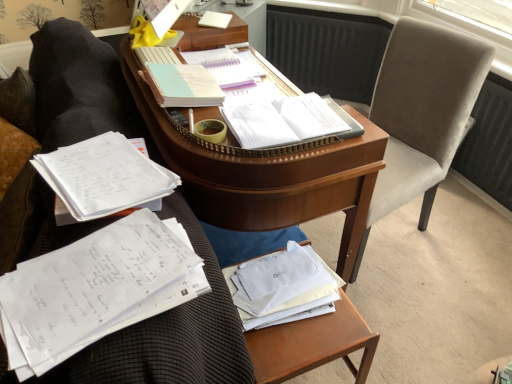
Measure the distance between point (152, 253) and camera.

A distance of 30.16 inches exists between point (152, 253) and camera.

What do you see at coordinates (96, 287) in the screenshot? I see `white paper at left` at bounding box center [96, 287].

Where is `light blue spiral notebook at center, which is the second book from back to front`? light blue spiral notebook at center, which is the second book from back to front is located at coordinates point(182,85).

You are a GUI agent. You are given a task and a screenshot of the screen. Output one action in this format:
    pyautogui.click(x=<x>, y=<y>)
    Task: Click on the light blue paper at center, the fourth book from the front
    Image resolution: width=512 pixels, height=384 pixels.
    Given the screenshot: What is the action you would take?
    pyautogui.click(x=228, y=67)

Image resolution: width=512 pixels, height=384 pixels. What do you see at coordinates (422, 113) in the screenshot? I see `velvet gray swivel chair at right` at bounding box center [422, 113].

You are a GUI agent. You are given a task and a screenshot of the screen. Output one action in this format:
    pyautogui.click(x=<x>, y=<y>)
    Task: Click on the white paper at left, which is the first book from front to back
    
    Given the screenshot: What is the action you would take?
    pyautogui.click(x=104, y=176)

The width and height of the screenshot is (512, 384). Find the location of `white paper at left`. white paper at left is located at coordinates (96, 287).

Considering the positions of points (106, 183) and (441, 163), is point (106, 183) farther from camera compared to point (441, 163)?

No, it is not.

Is white paper at left, the 4th book in the back-to-front sequence, in contact with velvet gray swivel chair at right?

white paper at left, the 4th book in the back-to-front sequence, and velvet gray swivel chair at right are clearly separated.

Where is `swivel chair on the right of the white paper at left, the 4th book in the back-to-front sequence`? swivel chair on the right of the white paper at left, the 4th book in the back-to-front sequence is located at coordinates (422, 113).

Does white paper at left, which is the first book from front to back, come behind velvet gray swivel chair at right?

No, white paper at left, which is the first book from front to back, is closer to the camera.

From a real-world perspective, is white paper at left, the 4th book in the back-to-front sequence, positioned above or below white paper at center, arranged as the 3th book when viewed from the back?

white paper at left, the 4th book in the back-to-front sequence, is below white paper at center, arranged as the 3th book when viewed from the back.

Looking at this image, can you confirm if white paper at left, which is the first book from front to back, is bigger than white paper at center, arranged as the 3th book when viewed from the back?

Correct, white paper at left, which is the first book from front to back, is larger in size than white paper at center, arranged as the 3th book when viewed from the back.

Which is in front, white paper at left, the 4th book in the back-to-front sequence, or white paper at center, arranged as the 3th book when viewed from the back?

white paper at left, the 4th book in the back-to-front sequence, is in front.

Could you tell me if white paper at left, the 4th book in the back-to-front sequence, is turned towards white paper at center, arranged as the 3th book when viewed from the back?

Yes.

Is white paper at center, arranged as the 3th book when viewed from the back, to the left of white paper at left from the viewer's perspective?

Incorrect, white paper at center, arranged as the 3th book when viewed from the back, is not on the left side of white paper at left.

From a real-world perspective, who is located higher, white paper at center, which is counted as the second book, starting from the front, or white paper at left?

white paper at center, which is counted as the second book, starting from the front, is physically above.

In the scene shown: From the image's perspective, does white paper at center, which is counted as the second book, starting from the front, appear higher than white paper at left?

Correct, white paper at center, which is counted as the second book, starting from the front, appears higher than white paper at left in the image.

Is wooden desk at center bigger or smaller than white paper at left, which is the first book from front to back?

wooden desk at center is bigger than white paper at left, which is the first book from front to back.

Could you measure the distance between wooden desk at center and white paper at left, which is the first book from front to back?

wooden desk at center and white paper at left, which is the first book from front to back, are 7.12 inches apart.

Considering the positions of point (201, 318) and point (130, 146), is point (201, 318) closer or farther from the camera than point (130, 146)?

Point (201, 318) is positioned closer to the camera compared to point (130, 146).

From the image's perspective, would you say wooden desk at center is shown under white paper at left, which is the first book from front to back?

Yes.

Is white paper at left turned away from white paper at left, which is the first book from front to back?

white paper at left does not have its back to white paper at left, which is the first book from front to back.

Is white paper at left wider or thinner than white paper at left, which is the first book from front to back?

In the image, white paper at left appears to be wider than white paper at left, which is the first book from front to back.

Considering the sizes of objects white paper at left and white paper at left, which is the first book from front to back, in the image provided, who is smaller, white paper at left or white paper at left, which is the first book from front to back,?

white paper at left.

Is light blue spiral notebook at center, the third book positioned from the front, taller than wooden at lower right?

No.

Considering the relative positions of light blue spiral notebook at center, which is the second book from back to front, and wooden at lower right in the image provided, is light blue spiral notebook at center, which is the second book from back to front, to the right of wooden at lower right from the viewer's perspective?

In fact, light blue spiral notebook at center, which is the second book from back to front, is to the left of wooden at lower right.

Is light blue spiral notebook at center, the third book positioned from the front, closer to the viewer compared to wooden at lower right?

No, it is not.

From the picture: Choose the correct answer: Is light blue spiral notebook at center, the third book positioned from the front, inside white paper at left, the 4th book in the back-to-front sequence, or outside it?

light blue spiral notebook at center, the third book positioned from the front, is not enclosed by white paper at left, the 4th book in the back-to-front sequence.

From a real-world perspective, is light blue spiral notebook at center, which is the second book from back to front, on top of white paper at left, which is the first book from front to back?

Yes, from a real-world perspective, light blue spiral notebook at center, which is the second book from back to front, is above white paper at left, which is the first book from front to back.

Considering the relative sizes of light blue spiral notebook at center, the third book positioned from the front, and white paper at left, the 4th book in the back-to-front sequence, in the image provided, is light blue spiral notebook at center, the third book positioned from the front, thinner than white paper at left, the 4th book in the back-to-front sequence,?

Indeed, light blue spiral notebook at center, the third book positioned from the front, has a lesser width compared to white paper at left, the 4th book in the back-to-front sequence.

Considering the positions of points (170, 64) and (143, 160), is point (170, 64) farther from camera compared to point (143, 160)?

Yes.

Locate an element on the screen. Image resolution: width=512 pixels, height=384 pixels. swivel chair above the white paper at left, which is the first book from front to back (from the image's perspective) is located at coordinates (422, 113).

Where is `book that is the 3rd one when counting rightward from the white paper at left, the 4th book in the back-to-front sequence`? The width and height of the screenshot is (512, 384). book that is the 3rd one when counting rightward from the white paper at left, the 4th book in the back-to-front sequence is located at coordinates (281, 121).

From the picture: From the image, which object appears to be farther from wooden at lower right, light blue paper at center, the fourth book from the front, or wooden desk at center?

light blue paper at center, the fourth book from the front, is further to wooden at lower right.

Looking at the image, which one is located further to white paper at left, velvet gray swivel chair at right or wooden desk at center?

velvet gray swivel chair at right.

Estimate the real-world distances between objects in this image. Which object is further from light blue paper at center, which ranks as the first book in back-to-front order, white paper at left or white paper at center, arranged as the 3th book when viewed from the back?

Among the two, white paper at left is located further to light blue paper at center, which ranks as the first book in back-to-front order.

From the image, which object appears to be nearer to wooden at lower right, light blue paper at center, which ranks as the first book in back-to-front order, or white paper at left, which is the first book from front to back?

white paper at left, which is the first book from front to back.

When comparing their distances from velvet gray swivel chair at right, does wooden desk at center or white paper at left seem further?

white paper at left.

Which object lies nearer to the anchor point white paper at left, which is the first book from front to back, light blue spiral notebook at center, the third book positioned from the front, or wooden desk at center?

wooden desk at center lies closer to white paper at left, which is the first book from front to back, than the other object.

Based on their spatial positions, is light blue paper at center, which ranks as the first book in back-to-front order, or wooden at lower right closer to white paper at left, which is the first book from front to back?

wooden at lower right lies closer to white paper at left, which is the first book from front to back, than the other object.

Considering their positions, is wooden desk at center positioned further to white paper at center, which is counted as the second book, starting from the front, than wooden at lower right?

wooden at lower right is positioned further to the anchor white paper at center, which is counted as the second book, starting from the front.

In order to click on document between light blue paper at center, the fourth book from the front, and wooden at lower right, in the vertical direction in this screenshot , I will do `click(96, 287)`.

This screenshot has height=384, width=512. I want to click on swivel chair between white paper at center, which is counted as the second book, starting from the front, and wooden at lower right in the up-down direction, so click(x=422, y=113).

Where is `book between light blue paper at center, which ranks as the first book in back-to-front order, and velvet gray swivel chair at right, in the horizontal direction`? book between light blue paper at center, which ranks as the first book in back-to-front order, and velvet gray swivel chair at right, in the horizontal direction is located at coordinates (281, 121).

Locate an element on the screen. This screenshot has height=384, width=512. document between wooden desk at center and white paper at center, which is counted as the second book, starting from the front, from left to right is located at coordinates (96, 287).